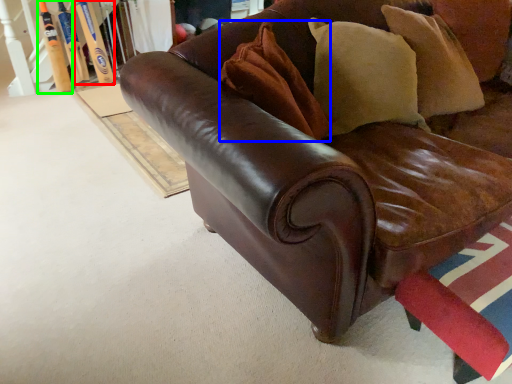
Question: Which is farther away from baseball bat (highlighted by a red box)? pillow (highlighted by a blue box) or baseball bat (highlighted by a green box)?

Choices:
 (A) pillow
 (B) baseball bat

Answer: (A)